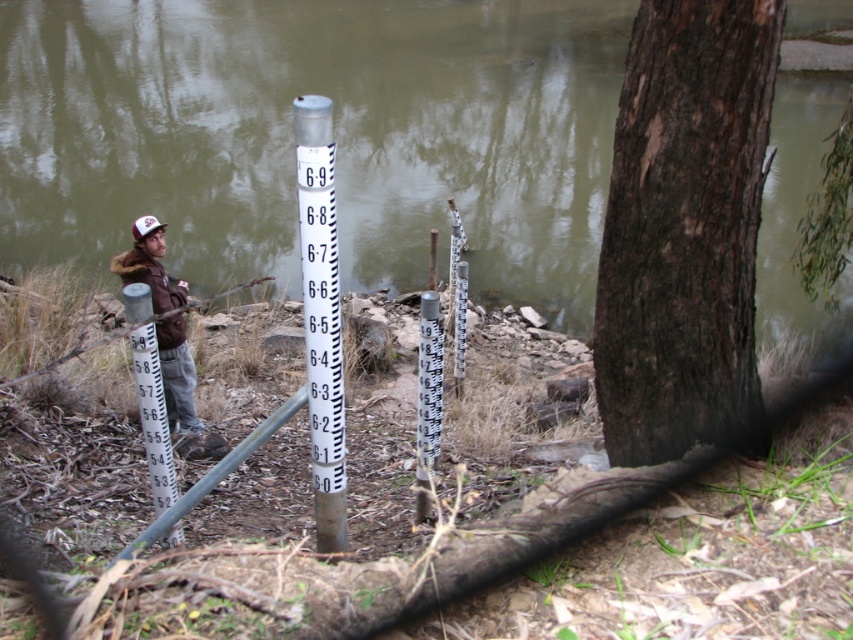
You are a surveyor standing at the riverbank and need to determine the distance between two points marked in the image. The points are labeled as point (x=136, y=385) and point (x=434, y=410). Based on the scene description, which point is closer to you?

Point (x=136, y=385) is closer to the camera than point (x=434, y=410).